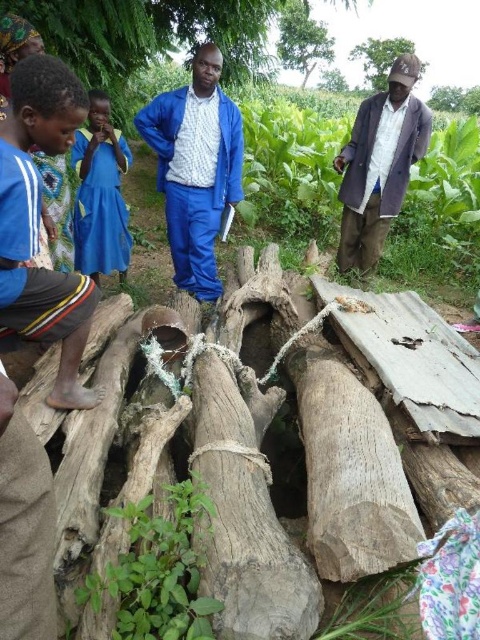
Question: Which point is closer to the camera taking this photo?

Choices:
 (A) (406, 184)
 (B) (416, 58)

Answer: (A)

Question: Which is nearer to the green leafy tree at upper center?

Choices:
 (A) dark gray fabric coat at right
 (B) brown rough tree trunk at upper right

Answer: (B)

Question: Can you confirm if blue fabric shirt at left is wider than green leafy tree at upper center?

Choices:
 (A) no
 (B) yes

Answer: (A)

Question: Considering the real-world distances, which object is closest to the brown rough tree trunk at upper right?

Choices:
 (A) blue fabric dress at center
 (B) blue fabric suit at center
 (C) blue fabric shirt at left

Answer: (A)

Question: Is blue fabric shirt at left to the left of green leafy tree at upper center from the viewer's perspective?

Choices:
 (A) no
 (B) yes

Answer: (B)

Question: From the image, what is the correct spatial relationship of blue fabric shirt at left in relation to green rough tree trunk at upper center?

Choices:
 (A) above
 (B) below

Answer: (B)